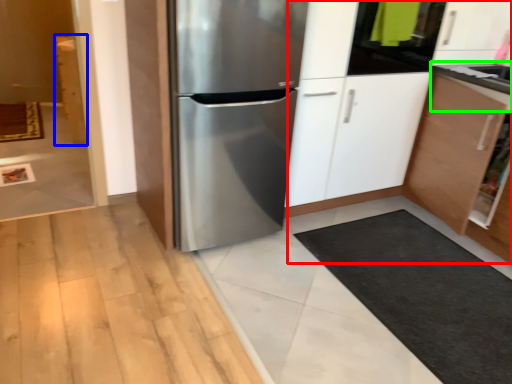
Question: Based on their relative distances, which object is nearer to dresser (highlighted by a red box)? Choose from cabinetry (highlighted by a blue box) and counter top (highlighted by a green box).

Choices:
 (A) cabinetry
 (B) counter top

Answer: (B)